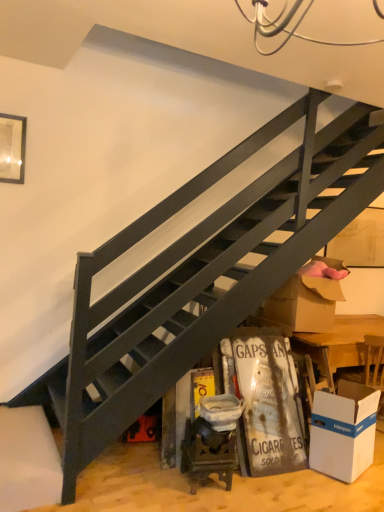
Locate an element on the screen. Image resolution: width=384 pixels, height=512 pixels. white cardboard box at lower right is located at coordinates (343, 431).

The width and height of the screenshot is (384, 512). Describe the element at coordinates (343, 431) in the screenshot. I see `white cardboard box at lower right` at that location.

Find the location of `brown cardboard box at lower right`. brown cardboard box at lower right is located at coordinates (306, 300).

This screenshot has width=384, height=512. What do you see at coordinates (306, 300) in the screenshot? I see `brown cardboard box at lower right` at bounding box center [306, 300].

Identify the location of white cardboard box at lower right. (343, 431).

In the scene shown: Considering the positions of objects brown cardboard box at lower right and white cardboard box at lower right in the image provided, who is more to the left, brown cardboard box at lower right or white cardboard box at lower right?

Positioned to the left is brown cardboard box at lower right.

Considering the positions of objects brown cardboard box at lower right and white cardboard box at lower right in the image provided, who is behind, brown cardboard box at lower right or white cardboard box at lower right?

brown cardboard box at lower right is more distant.

Is point (331, 278) more distant than point (354, 423)?

Yes.

From the image's perspective, does brown cardboard box at lower right appear lower than white cardboard box at lower right?

Actually, brown cardboard box at lower right appears above white cardboard box at lower right in the image.

From a real-world perspective, is brown cardboard box at lower right located beneath white cardboard box at lower right?

No.

Between brown cardboard box at lower right and white cardboard box at lower right, which one has larger width?

brown cardboard box at lower right is wider.

Considering the sizes of objects brown cardboard box at lower right and white cardboard box at lower right in the image provided, who is shorter, brown cardboard box at lower right or white cardboard box at lower right?

white cardboard box at lower right is shorter.

Looking at this image, considering the relative sizes of brown cardboard box at lower right and white cardboard box at lower right in the image provided, is brown cardboard box at lower right smaller than white cardboard box at lower right?

No, brown cardboard box at lower right is not smaller than white cardboard box at lower right.

Based on the photo, is brown cardboard box at lower right inside the boundaries of white cardboard box at lower right, or outside?

brown cardboard box at lower right is outside white cardboard box at lower right.

From the picture: Does brown cardboard box at lower right touch white cardboard box at lower right?

No, brown cardboard box at lower right is not next to white cardboard box at lower right.

Could you tell me if brown cardboard box at lower right is turned towards white cardboard box at lower right?

No, brown cardboard box at lower right is not oriented towards white cardboard box at lower right.

Can you tell me how much brown cardboard box at lower right and white cardboard box at lower right differ in facing direction?

20.2 degrees separate the facing orientations of brown cardboard box at lower right and white cardboard box at lower right.

How distant is brown cardboard box at lower right from white cardboard box at lower right?

brown cardboard box at lower right is 30.53 inches away from white cardboard box at lower right.

Locate an element on the screen. The height and width of the screenshot is (512, 384). box in front of the brown cardboard box at lower right is located at coordinates (343, 431).

Would you say white cardboard box at lower right is to the left or to the right of brown cardboard box at lower right in the picture?

From the image, it's evident that white cardboard box at lower right is to the right of brown cardboard box at lower right.

Considering their positions, is white cardboard box at lower right located in front of or behind brown cardboard box at lower right?

Visually, white cardboard box at lower right is located in front of brown cardboard box at lower right.

Between point (310, 463) and point (316, 260), which one is positioned in front?

Point (310, 463)

From the image's perspective, which is above, white cardboard box at lower right or brown cardboard box at lower right?

brown cardboard box at lower right is shown above in the image.

Consider the image. From a real-world perspective, relative to brown cardboard box at lower right, is white cardboard box at lower right vertically above or below?

Clearly, from a real-world perspective, white cardboard box at lower right is below brown cardboard box at lower right.

Considering the sizes of objects white cardboard box at lower right and brown cardboard box at lower right in the image provided, who is thinner, white cardboard box at lower right or brown cardboard box at lower right?

Thinner between the two is white cardboard box at lower right.

Does white cardboard box at lower right have a greater height compared to brown cardboard box at lower right?

No, white cardboard box at lower right is not taller than brown cardboard box at lower right.

Can you confirm if white cardboard box at lower right is bigger than brown cardboard box at lower right?

No.

Is white cardboard box at lower right not inside brown cardboard box at lower right?

Yes, white cardboard box at lower right is located beyond the bounds of brown cardboard box at lower right.

Are white cardboard box at lower right and brown cardboard box at lower right far apart?

white cardboard box at lower right is near brown cardboard box at lower right, not far away.

Is white cardboard box at lower right looking in the opposite direction of brown cardboard box at lower right?

No, brown cardboard box at lower right is not at the back of white cardboard box at lower right.

Can you tell me how much white cardboard box at lower right and brown cardboard box at lower right differ in facing direction?

The angular difference between white cardboard box at lower right and brown cardboard box at lower right is 20.2 degrees.

Measure the distance between white cardboard box at lower right and brown cardboard box at lower right.

30.53 inches.

Find the location of a particular element. cardboard box lying on the left of white cardboard box at lower right is located at coordinates (306, 300).

Find the location of a particular element. Image resolution: width=384 pixels, height=512 pixels. box below the brown cardboard box at lower right (from the image's perspective) is located at coordinates (343, 431).

You are a GUI agent. You are given a task and a screenshot of the screen. Output one action in this format:
    pyautogui.click(x=<x>, y=<y>)
    Task: Click on the cardboard box lying behind the white cardboard box at lower right
    This screenshot has height=512, width=384.
    Given the screenshot: What is the action you would take?
    pyautogui.click(x=306, y=300)